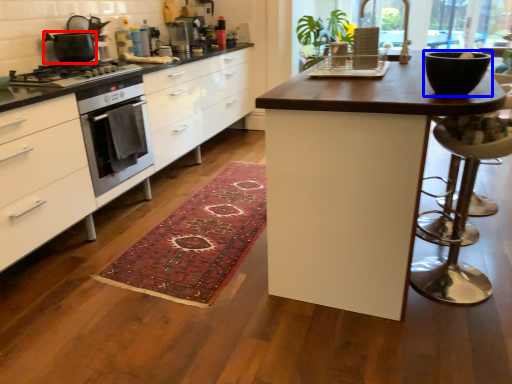
Question: Among these objects, which one is nearest to the camera, kitchen appliance (highlighted by a red box) or bowl (highlighted by a blue box)?

Choices:
 (A) kitchen appliance
 (B) bowl

Answer: (B)